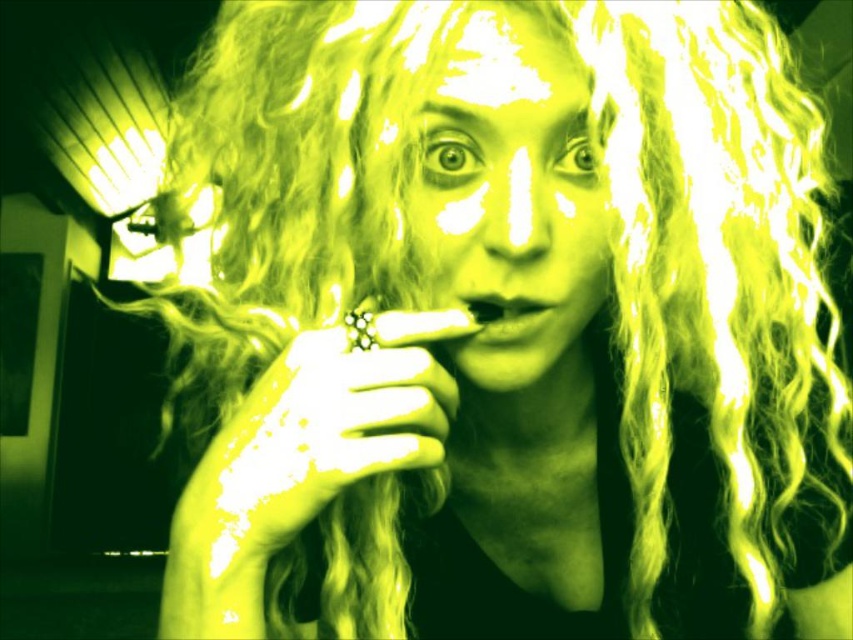
Which is behind, point (595, 248) or point (511, 312)?

The point (595, 248) is more distant.

Is matte yellow face at center behind smooth matte mouth at center?

No, it is not.

Which is in front, point (506, 141) or point (502, 308)?

Positioned in front is point (506, 141).

Locate an element on the screen. matte yellow face at center is located at coordinates (511, 198).